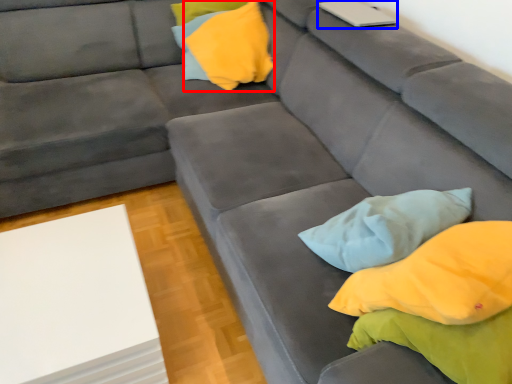
Question: Which object is further to the camera taking this photo, pillow (highlighted by a red box) or laptop (highlighted by a blue box)?

Choices:
 (A) pillow
 (B) laptop

Answer: (A)